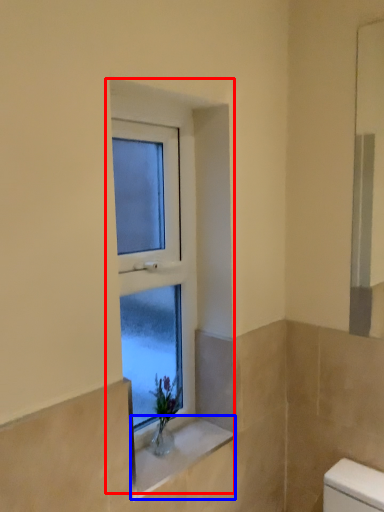
Question: Which object is further to the camera taking this photo, window (highlighted by a red box) or window sill (highlighted by a blue box)?

Choices:
 (A) window
 (B) window sill

Answer: (B)